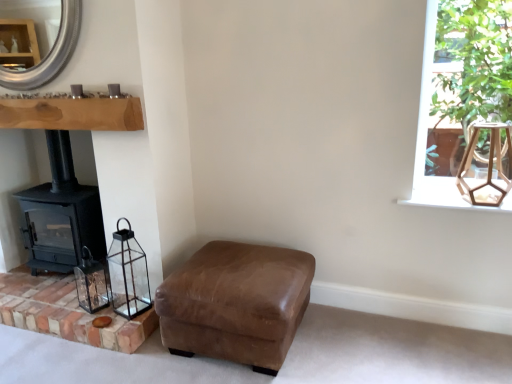
The image size is (512, 384). Identify the location of vacant space to the left of clear glass lantern at lower left. (67, 303).